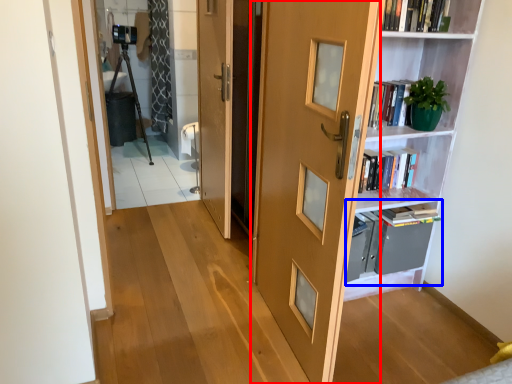
Question: Which object is closer to the camera taking this photo, door (highlighted by a red box) or cabinet (highlighted by a blue box)?

Choices:
 (A) door
 (B) cabinet

Answer: (A)